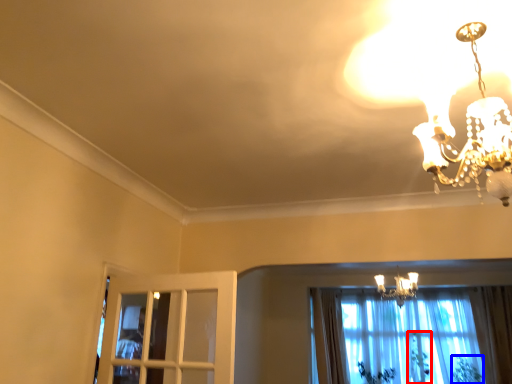
Question: Which of the following is the closest to the observer, plant (highlighted by a red box) or plant (highlighted by a blue box)?

Choices:
 (A) plant
 (B) plant

Answer: (B)